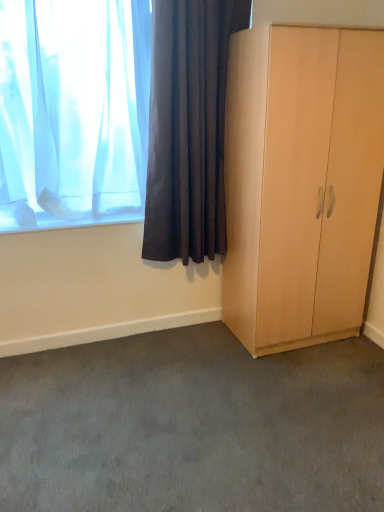
Question: Is light wood wardrobe at right next to gray carpet at lower center and touching it?

Choices:
 (A) yes
 (B) no

Answer: (B)

Question: From a real-world perspective, is light wood wardrobe at right below gray carpet at lower center?

Choices:
 (A) no
 (B) yes

Answer: (A)

Question: Can you confirm if light wood wardrobe at right is bigger than gray carpet at lower center?

Choices:
 (A) no
 (B) yes

Answer: (B)

Question: Can you confirm if light wood wardrobe at right is wider than gray carpet at lower center?

Choices:
 (A) no
 (B) yes

Answer: (A)

Question: From the image's perspective, is light wood wardrobe at right under gray carpet at lower center?

Choices:
 (A) no
 (B) yes

Answer: (A)

Question: Does light wood wardrobe at right have a smaller size compared to gray carpet at lower center?

Choices:
 (A) no
 (B) yes

Answer: (A)

Question: Does translucent fabric curtain at upper left, positioned as the 1th curtain in left-to-right order, have a lesser height compared to dark fabric curtain at upper left, which appears as the first curtain when viewed from the right?

Choices:
 (A) no
 (B) yes

Answer: (B)

Question: From the image's perspective, is translucent fabric curtain at upper left, positioned as the 1th curtain in left-to-right order, above dark fabric curtain at upper left, which appears as the first curtain when viewed from the right?

Choices:
 (A) no
 (B) yes

Answer: (B)

Question: From a real-world perspective, is translucent fabric curtain at upper left, positioned as the 1th curtain in left-to-right order, on dark fabric curtain at upper left, which appears as the first curtain when viewed from the right?

Choices:
 (A) yes
 (B) no

Answer: (A)

Question: Is translucent fabric curtain at upper left, which is the 2th curtain in right-to-left order, further to the viewer compared to dark fabric curtain at upper left, which appears as the first curtain when viewed from the right?

Choices:
 (A) no
 (B) yes

Answer: (A)

Question: Can you confirm if translucent fabric curtain at upper left, which is the 2th curtain in right-to-left order, is wider than dark fabric curtain at upper left, which appears as the first curtain when viewed from the right?

Choices:
 (A) yes
 (B) no

Answer: (A)

Question: Is translucent fabric curtain at upper left, positioned as the 1th curtain in left-to-right order, at the left side of dark fabric curtain at upper left, the second curtain in the left-to-right sequence?

Choices:
 (A) yes
 (B) no

Answer: (A)

Question: Could gray carpet at lower center be considered to be inside translucent fabric curtain at upper left, which is the 2th curtain in right-to-left order?

Choices:
 (A) no
 (B) yes

Answer: (A)